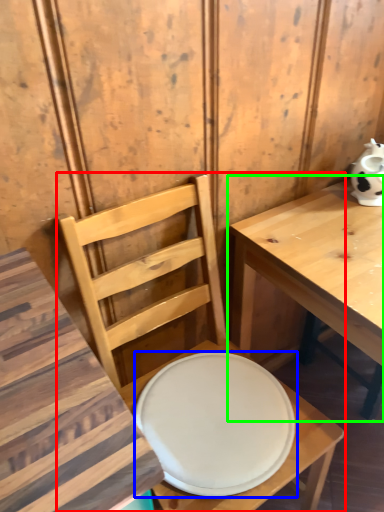
Question: Based on their relative distances, which object is nearer to chair (highlighted by a red box)? Choose from plate (highlighted by a blue box) and table (highlighted by a green box).

Choices:
 (A) plate
 (B) table

Answer: (A)